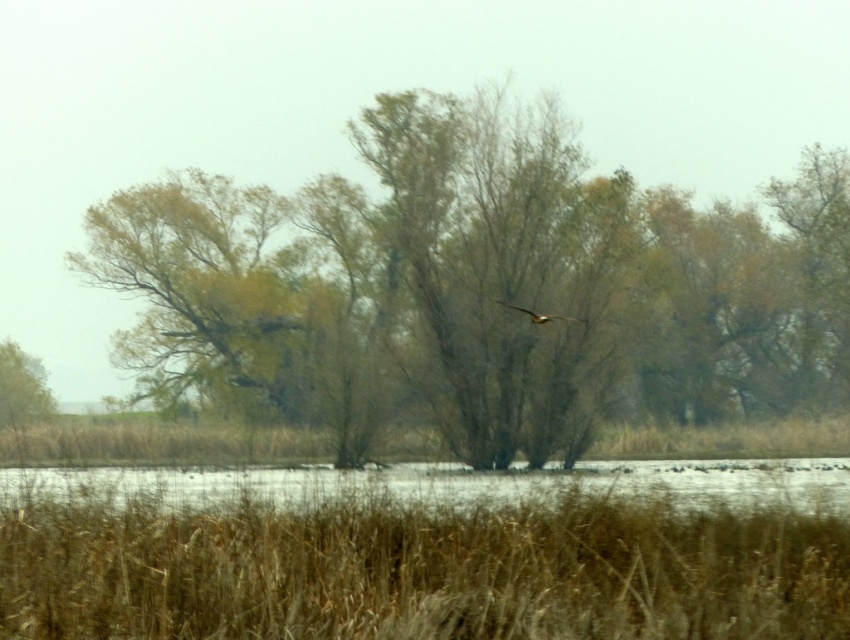
Question: Can you confirm if clear water at lower center is smaller than brown leafy tree at left?

Choices:
 (A) yes
 (B) no

Answer: (B)

Question: Which point is farther from the camera taking this photo?

Choices:
 (A) (494, 474)
 (B) (656, 390)
 (C) (748, 500)

Answer: (B)

Question: Is clear water at lower center below brown feathered bird at center?

Choices:
 (A) yes
 (B) no

Answer: (A)

Question: Does brown dry grass at lower center have a smaller size compared to brown leafy tree at left?

Choices:
 (A) yes
 (B) no

Answer: (B)

Question: Which is nearer to the brown feathered bird at center?

Choices:
 (A) clear water at lower center
 (B) brown leafy tree at center
 (C) brown dry grass at lower center
 (D) brown leafy tree at left

Answer: (A)

Question: Which point is farther to the camera?

Choices:
 (A) (527, 308)
 (B) (511, 228)
 (C) (44, 396)
 (D) (531, 499)

Answer: (C)